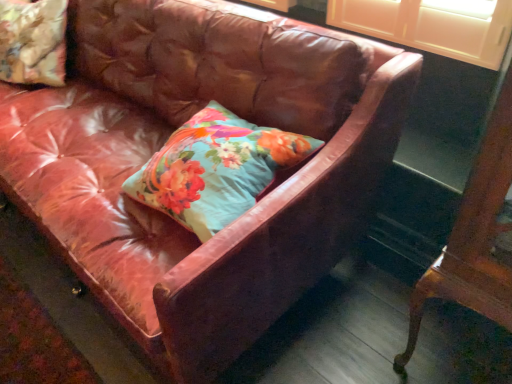
Question: From a real-world perspective, relative to floral fabric cushion at upper left, which is counted as the 1th pillow, starting from the left, is floral fabric pillow at center, the second pillow from the back, vertically above or below?

Choices:
 (A) below
 (B) above

Answer: (A)

Question: Does point (304, 152) appear closer or farther from the camera than point (8, 81)?

Choices:
 (A) closer
 (B) farther

Answer: (A)

Question: Estimate the real-world distances between objects in this image. Which object is farther from the mahogany wood table at right?

Choices:
 (A) floral fabric cushion at upper left, which appears as the second pillow when viewed from the front
 (B) floral fabric pillow at center, the second pillow from the back

Answer: (A)

Question: Considering the real-world distances, which object is closest to the floral fabric cushion at upper left, which appears as the first pillow when viewed from the back?

Choices:
 (A) mahogany wood table at right
 (B) floral fabric pillow at center, the second pillow viewed from the left

Answer: (B)